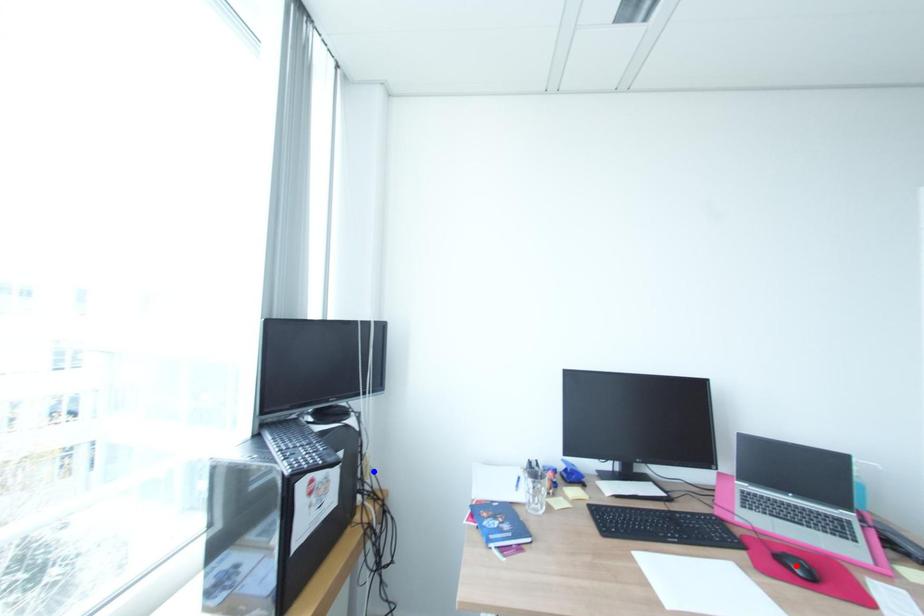
Question: Two points are marked on the image. Which point is closer to the camera?

Choices:
 (A) Blue point is closer.
 (B) Red point is closer.

Answer: (B)